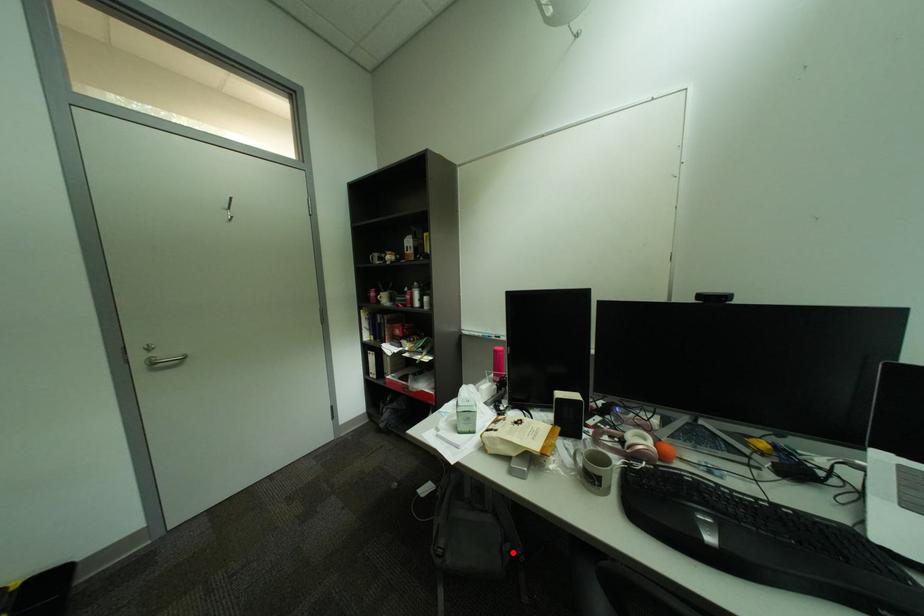
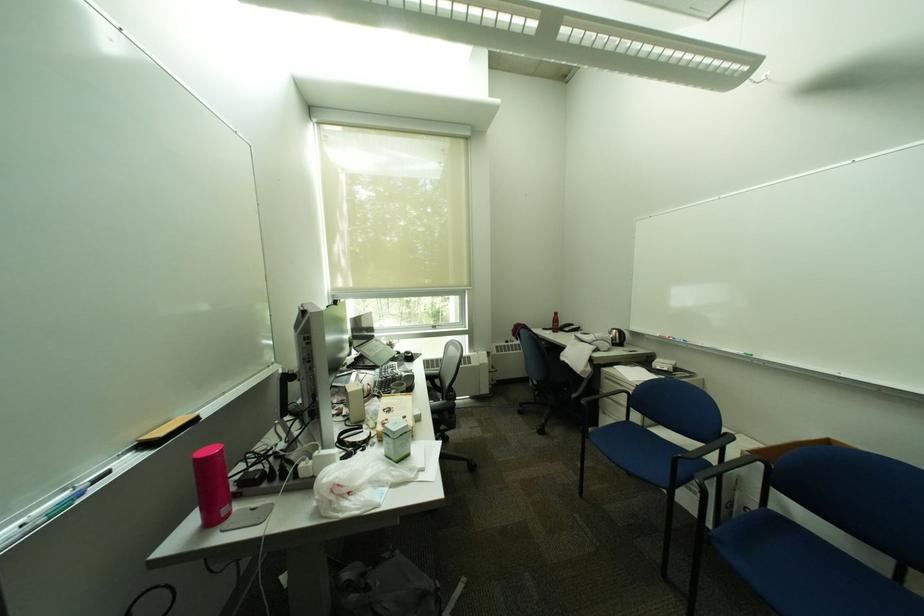
Question: I am providing you with two images of the same scene from different viewpoints. A red point is shown in image1. For the corresponding object point in image2, is it positioned nearer or farther from the camera?

Choices:
 (A) Nearer
 (B) Farther

Answer: (A)